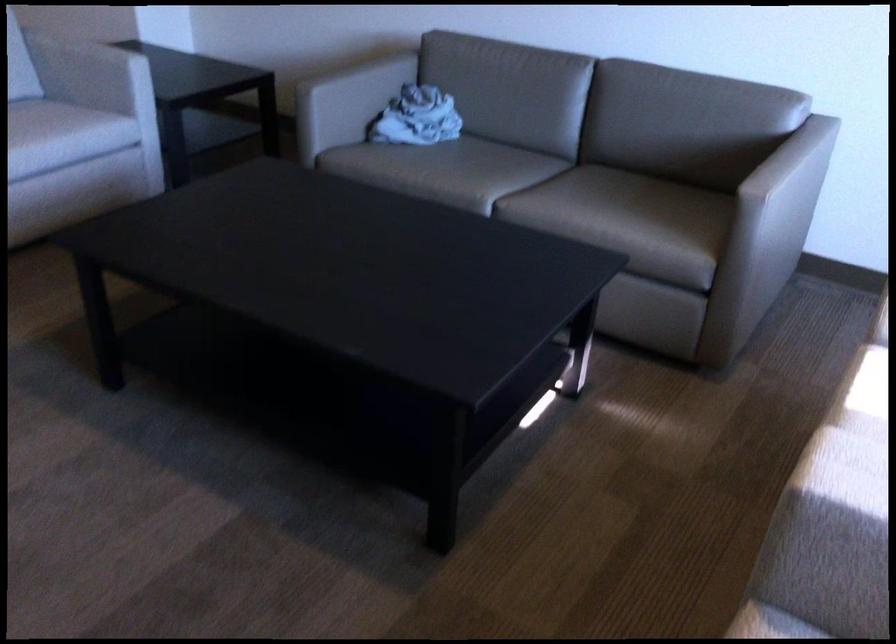
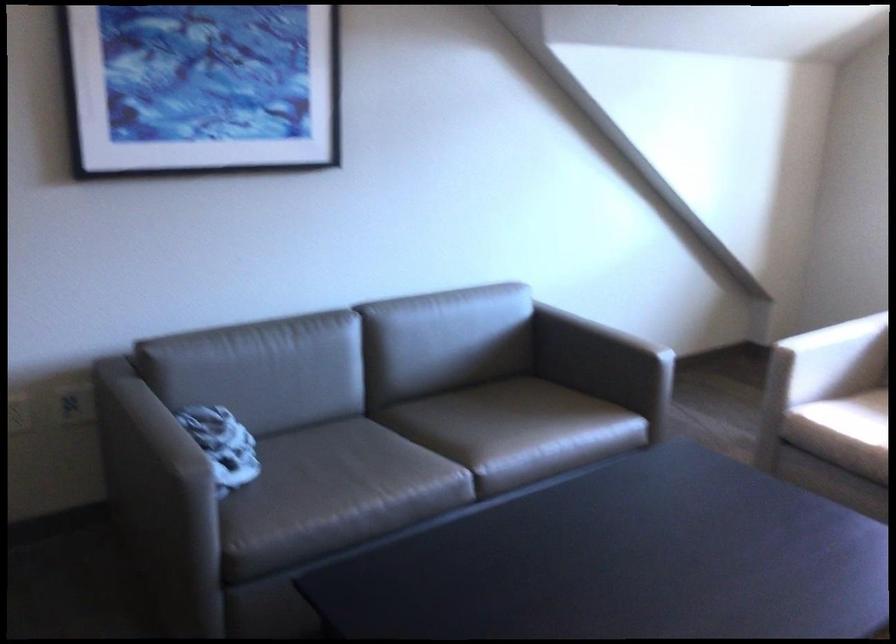
In the second image, find the point that corresponds to (287,90) in the first image.

(158, 491)